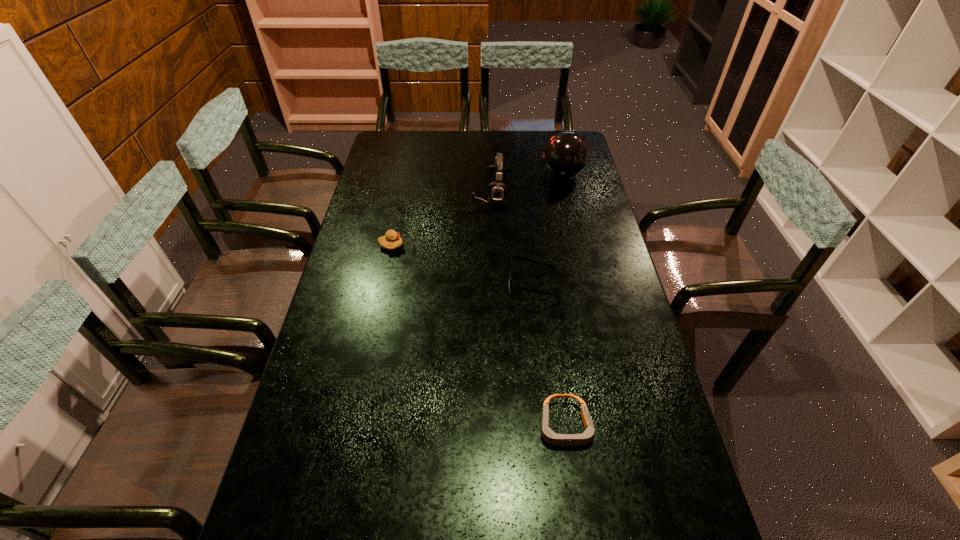
Image resolution: width=960 pixels, height=540 pixels. What are the coordinates of `object at the right edge` in the screenshot? It's located at (566, 154).

Where is `free location at the far edge`? free location at the far edge is located at coordinates (506, 137).

You are a GUI agent. You are given a task and a screenshot of the screen. Output one action in this format:
    pyautogui.click(x=<x>, y=<y>)
    Task: Click on the vacant space at the left edge of the desktop
    This screenshot has width=960, height=540.
    Given the screenshot: What is the action you would take?
    pyautogui.click(x=384, y=288)

You are a GUI agent. You are given a task and a screenshot of the screen. Output one action in this format:
    pyautogui.click(x=<x>, y=<y>)
    Task: Click on the vacant space at the right edge of the desktop
    The width and height of the screenshot is (960, 540).
    Given the screenshot: What is the action you would take?
    pyautogui.click(x=607, y=258)

Where is `vacant space at the far left corner`? Image resolution: width=960 pixels, height=540 pixels. vacant space at the far left corner is located at coordinates (393, 138).

This screenshot has height=540, width=960. I want to click on free space between the third farthest object and the sunglasses, so click(462, 264).

Locate an element on the screen. This screenshot has width=960, height=540. empty space that is in between the headset and the second nearest object is located at coordinates (511, 239).

The width and height of the screenshot is (960, 540). Find the location of `free space between the leftmost object and the second nearest object`. free space between the leftmost object and the second nearest object is located at coordinates (462, 264).

You are a GUI agent. You are given a task and a screenshot of the screen. Output one action in this format:
    pyautogui.click(x=<x>, y=<y>)
    Task: Click on the empty space between the shortest object and the headset
    This screenshot has width=960, height=540.
    Given the screenshot: What is the action you would take?
    pyautogui.click(x=527, y=310)

Find the location of a particular element. free spot between the nearest object and the bowling ball is located at coordinates (564, 300).